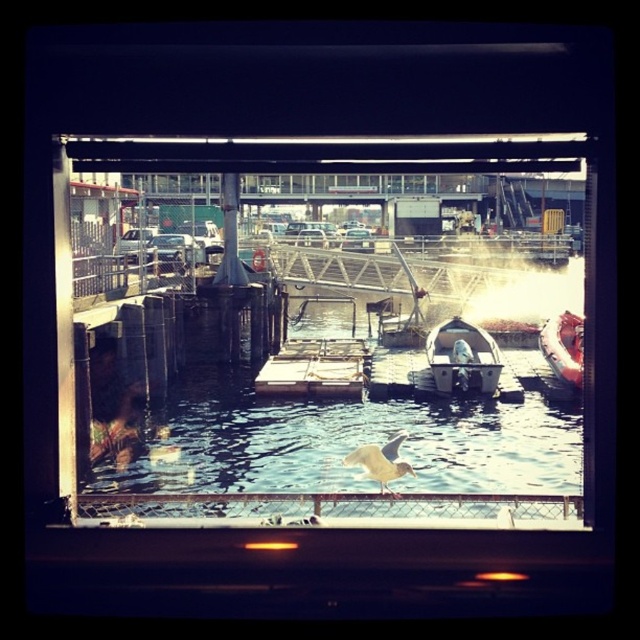
Question: Observing the image, what is the correct spatial positioning of white plastic dock at center in reference to rubberized red boat at right?

Choices:
 (A) right
 (B) left

Answer: (B)

Question: Which point is closer to the camera taking this photo?

Choices:
 (A) (456, 381)
 (B) (445, 499)

Answer: (B)

Question: Can you confirm if transparent glass window at center is smaller than white plastic dock at center?

Choices:
 (A) yes
 (B) no

Answer: (B)

Question: Which of the following is the farthest from the observer?

Choices:
 (A) transparent glass window at center
 (B) white plastic boat at center

Answer: (B)

Question: Estimate the real-world distances between objects in this image. Which object is closer to the rubberized red boat at right?

Choices:
 (A) white plastic boat at center
 (B) white plastic dock at center

Answer: (A)

Question: Is white plastic dock at center below rubberized red boat at right?

Choices:
 (A) no
 (B) yes

Answer: (B)